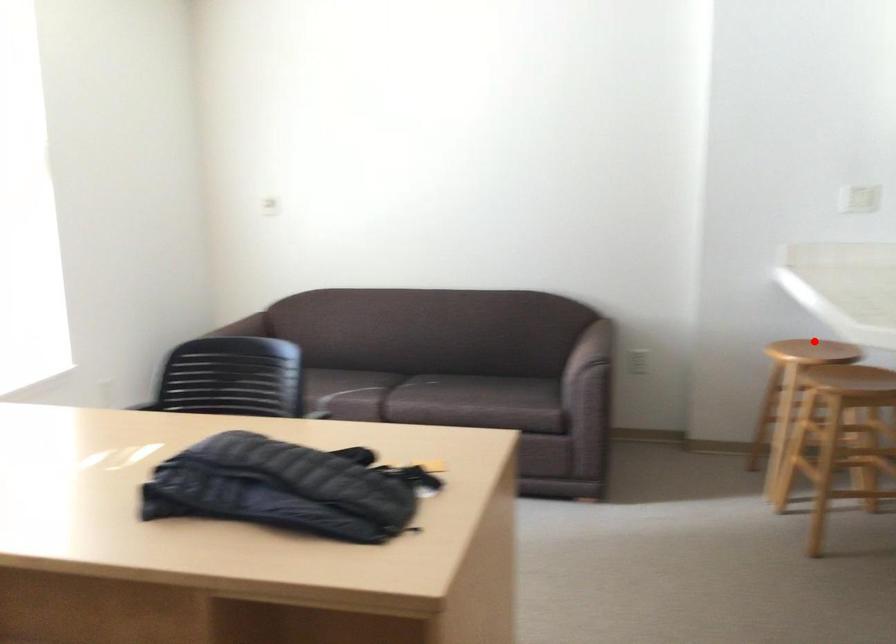
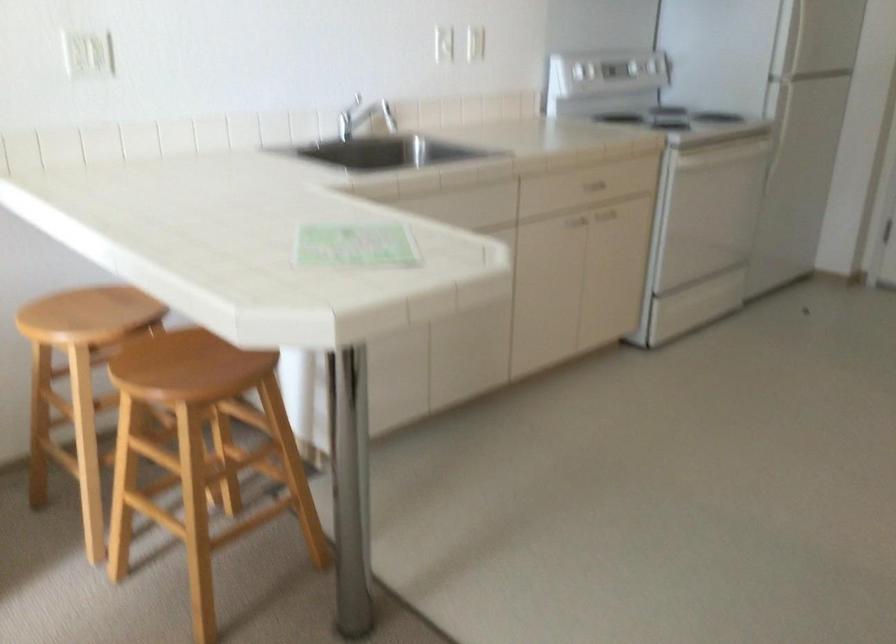
Find the pixel in the second image that matches the highlighted location in the first image.

(82, 315)